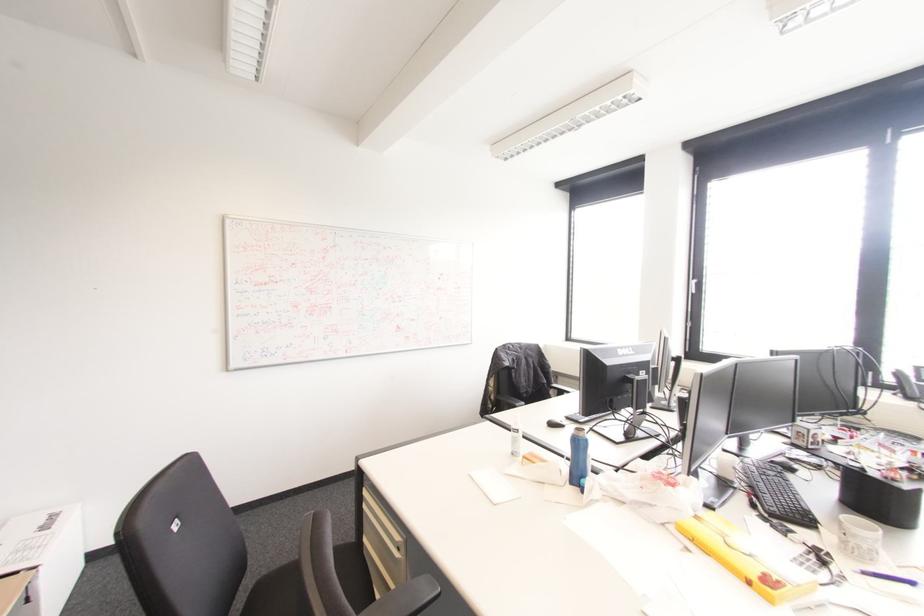
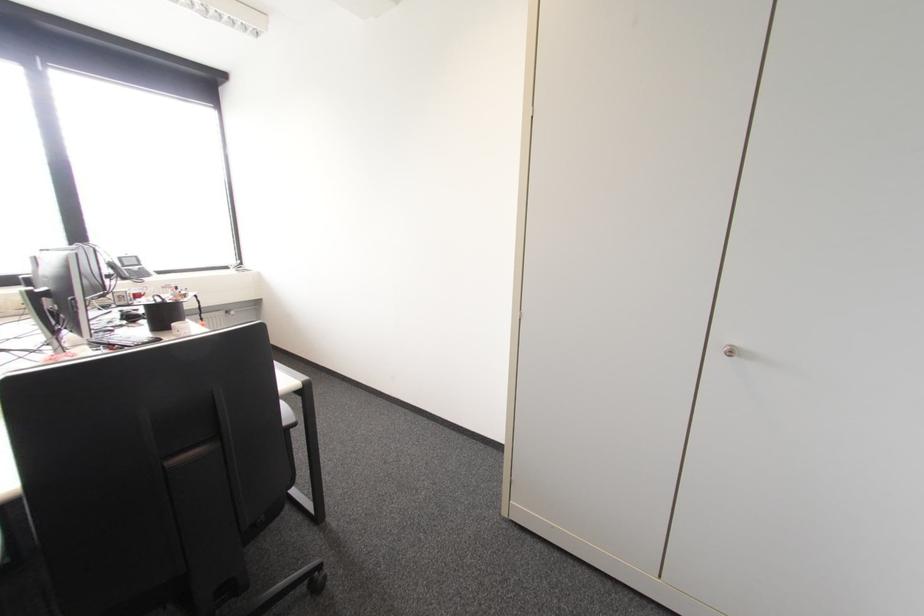
Where in the second image is the point corresponding to point 843,462 from the first image?

(148, 306)